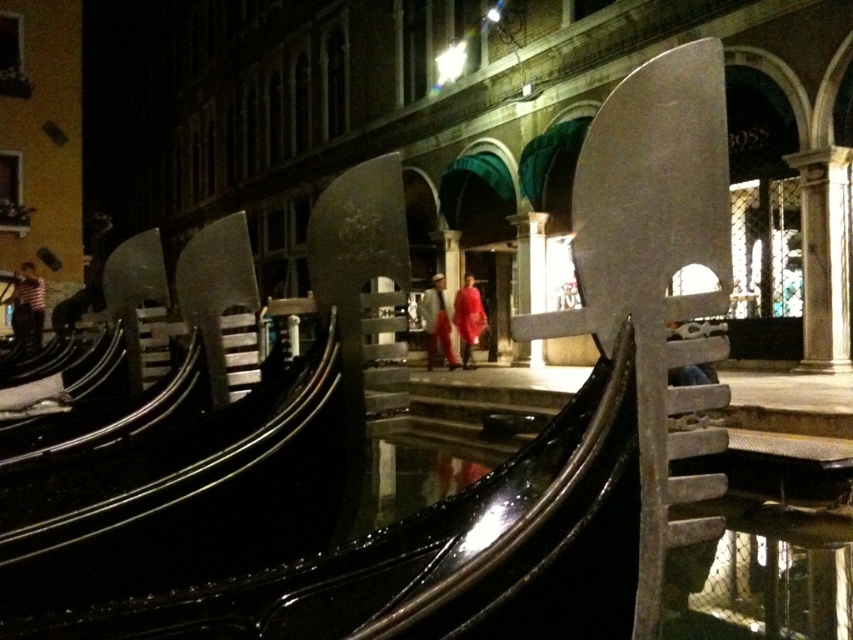
Question: Does striped cotton shirt at left appear under matte red cape at center?

Choices:
 (A) no
 (B) yes

Answer: (A)

Question: Estimate the real-world distances between objects in this image. Which object is closer to the striped cotton shirt at left?

Choices:
 (A) red fabric coat at center
 (B) matte red cape at center

Answer: (A)

Question: Which object is closer to the camera taking this photo?

Choices:
 (A) striped cotton shirt at left
 (B) red fabric coat at center
 (C) matte red cape at center

Answer: (A)

Question: Which object is the closest to the red fabric coat at center?

Choices:
 (A) striped cotton shirt at left
 (B) matte red cape at center

Answer: (B)

Question: Does striped cotton shirt at left have a smaller size compared to red fabric coat at center?

Choices:
 (A) no
 (B) yes

Answer: (A)

Question: Is striped cotton shirt at left smaller than red fabric coat at center?

Choices:
 (A) no
 (B) yes

Answer: (A)